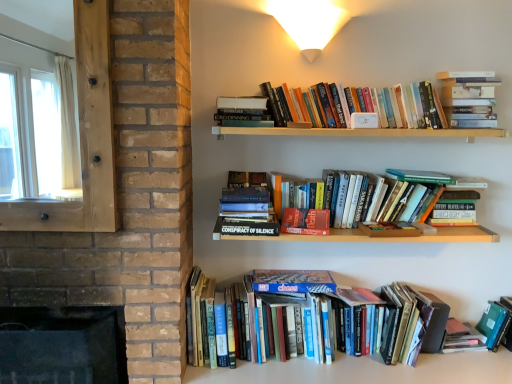
The height and width of the screenshot is (384, 512). Identify the location of vacant region above hardcover book at center right, the second paperback book when ordered from right to left (from a real-world perspective). (458, 183).